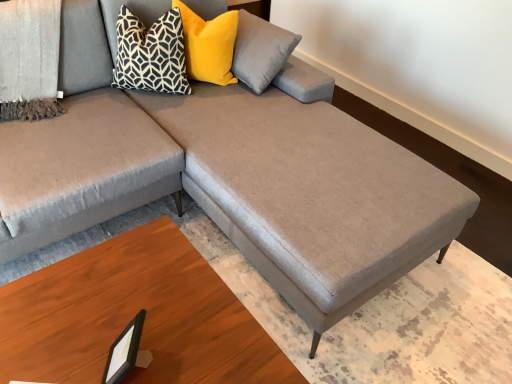
At what (x,y) coordinates should I click in order to perform the action: click on vacant space positioned to the left of black plastic picture frame at lower left. Please return your answer as a coordinate pair (x, y). Image resolution: width=512 pixels, height=384 pixels. Looking at the image, I should click on (65, 349).